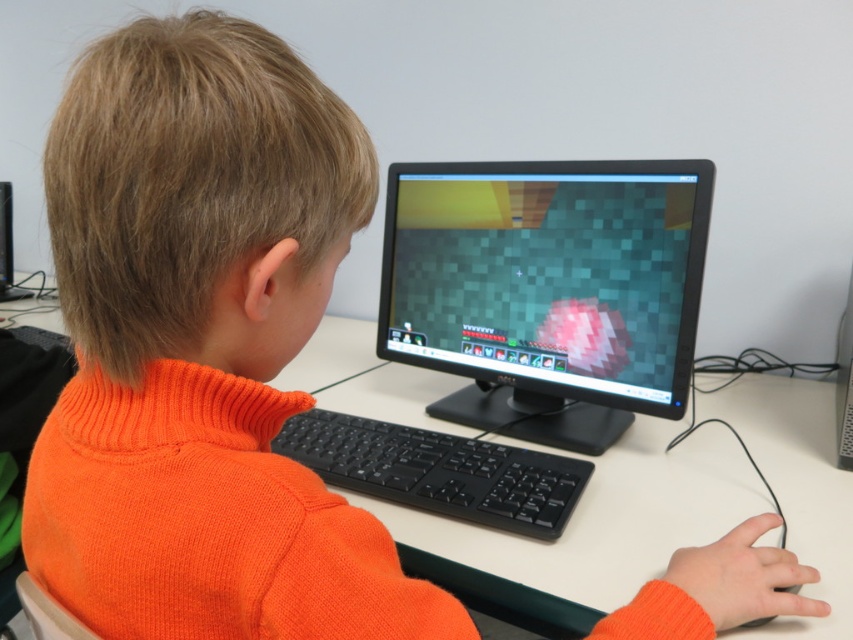
Who is positioned more to the left, black glossy monitor at center or black plastic keyboard at center?

black plastic keyboard at center

Who is more distant from viewer, (531, 253) or (519, 484)?

The point (531, 253) is more distant.

Is point (512, 362) farther from camera compared to point (346, 465)?

Yes, it is.

I want to click on black glossy monitor at center, so click(547, 291).